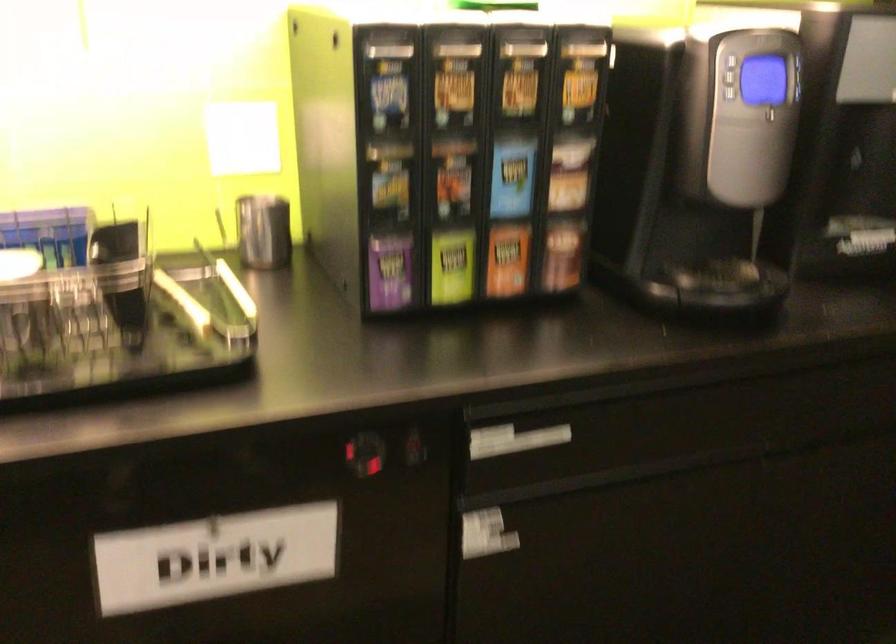
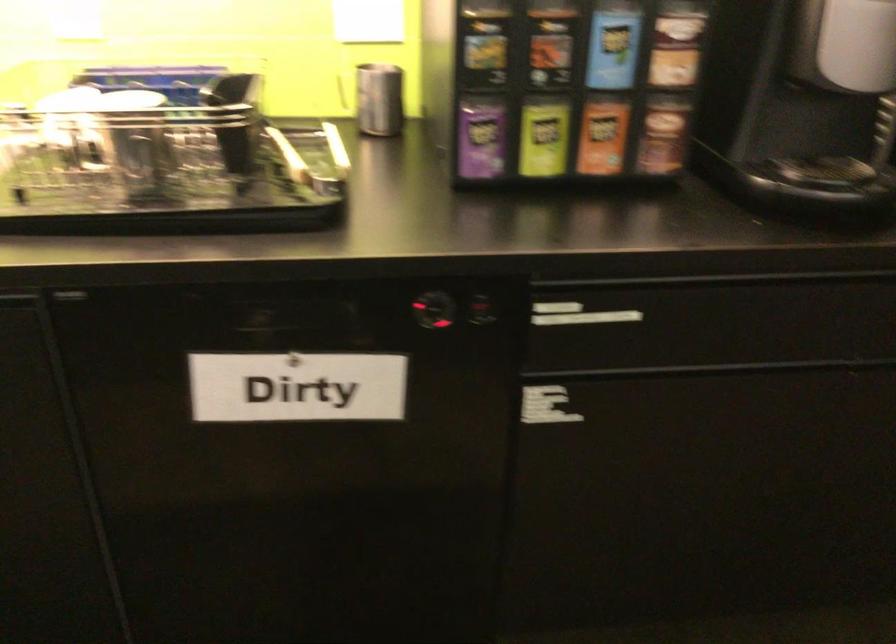
The point at [388,269] is marked in the first image. Where is the corresponding point in the second image?

(479, 138)